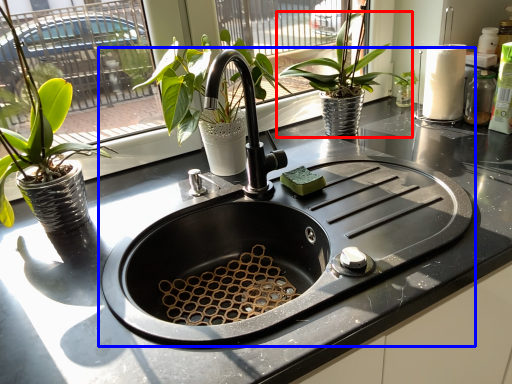
Question: Which object appears farthest to the camera in this image, houseplant (highlighted by a red box) or sink (highlighted by a blue box)?

Choices:
 (A) houseplant
 (B) sink

Answer: (A)